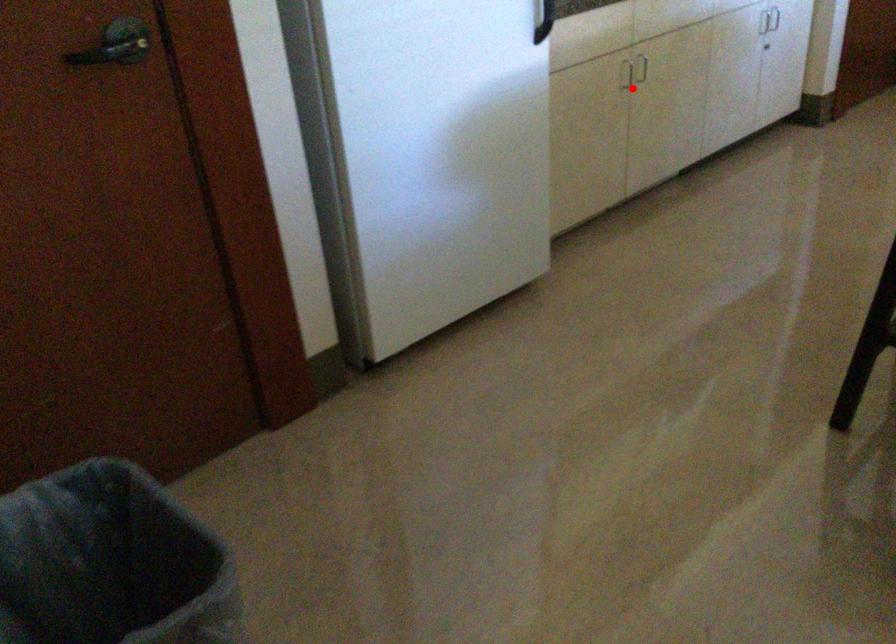
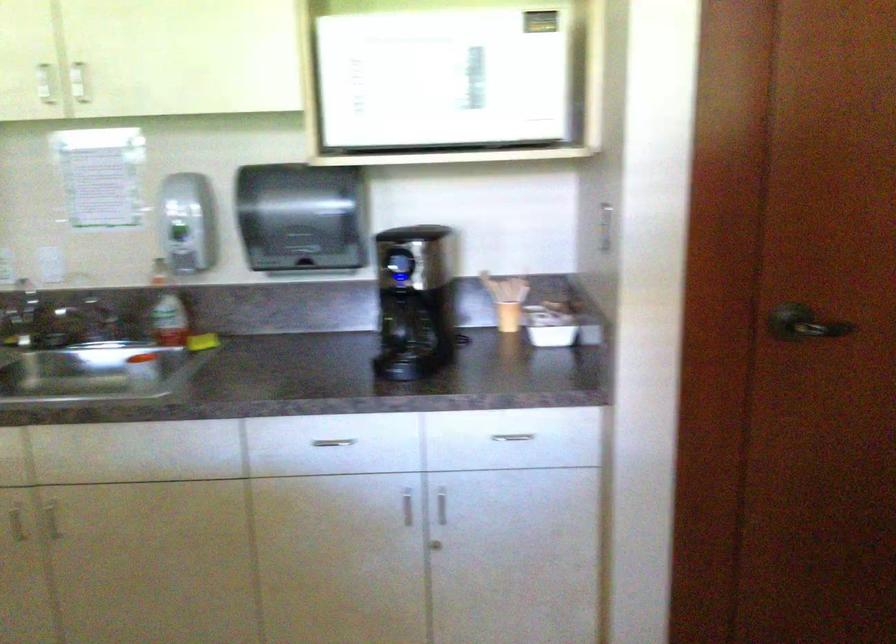
The point at the highlighted location is marked in the first image. Where is the corresponding point in the second image?

(15, 522)